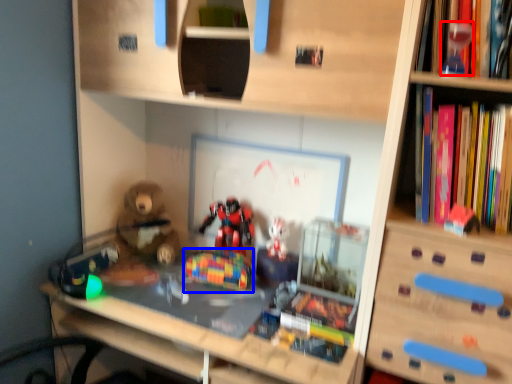
Question: Which of the following is the farthest to the observer, toy (highlighted by a red box) or toy (highlighted by a blue box)?

Choices:
 (A) toy
 (B) toy

Answer: (B)